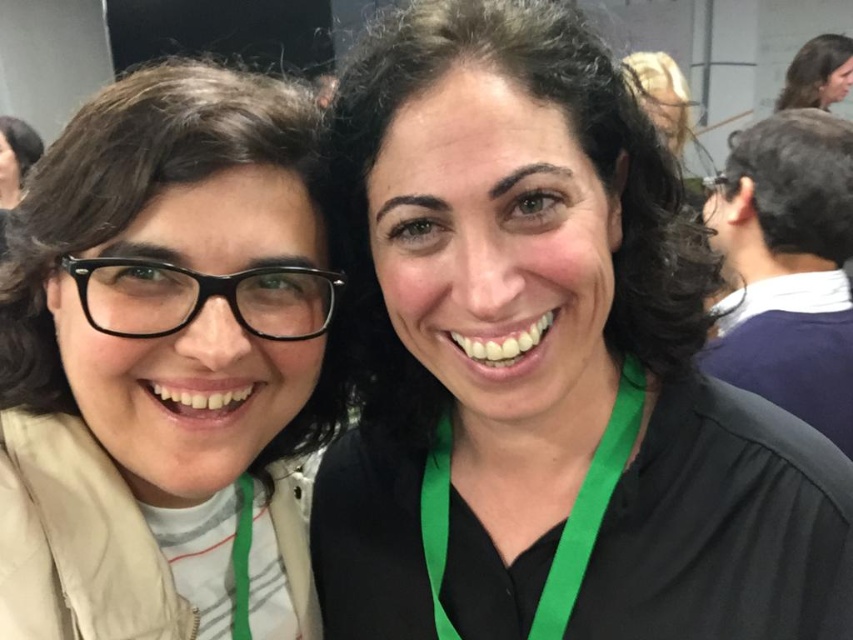
Question: Which is farther from the black matte shirt at center?

Choices:
 (A) matte black glasses at left
 (B) green fabric lanyard at center

Answer: (A)

Question: Is black matte shirt at center behind green fabric lanyard at center?

Choices:
 (A) yes
 (B) no

Answer: (B)

Question: Which object appears closest to the camera in this image?

Choices:
 (A) black matte shirt at center
 (B) matte black glasses at left

Answer: (A)

Question: Among these points, which one is farthest from the camera?

Choices:
 (A) (51, 500)
 (B) (625, 404)
 (C) (631, 490)

Answer: (B)

Question: Can you confirm if matte black glasses at left is positioned to the left of green fabric lanyard at center?

Choices:
 (A) no
 (B) yes

Answer: (B)

Question: Is black matte shirt at center wider than green fabric lanyard at center?

Choices:
 (A) no
 (B) yes

Answer: (B)